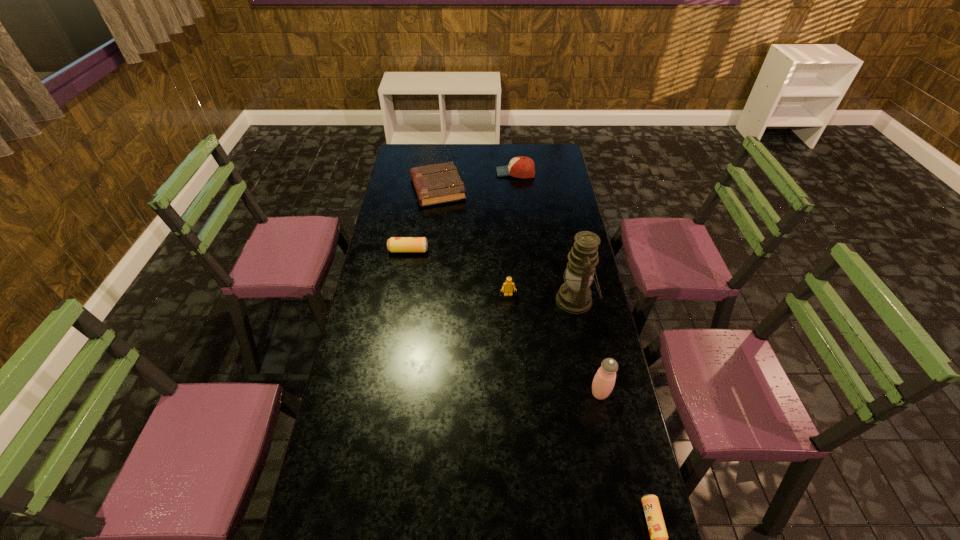
Identify the location of free spot that satisfies the following two spatial constraints: 1. on the front-facing side of the baseball cap; 2. on the right side of the second nearest object. The height and width of the screenshot is (540, 960). (538, 394).

You are a GUI agent. You are given a task and a screenshot of the screen. Output one action in this format:
    pyautogui.click(x=<x>, y=<y>)
    Task: Click on the vacant position in the image that satisfies the following two spatial constraints: 1. on the face of the oil lamp; 2. on the right side of the Lego
    
    Given the screenshot: What is the action you would take?
    pyautogui.click(x=509, y=300)

I want to click on vacant space that satisfies the following two spatial constraints: 1. on the front side of the farther beer can; 2. on the left side of the thermos bottle, so [x=385, y=394].

Locate an element on the screen. vacant region that satisfies the following two spatial constraints: 1. on the front side of the hardback book; 2. on the right side of the thermos bottle is located at coordinates (414, 394).